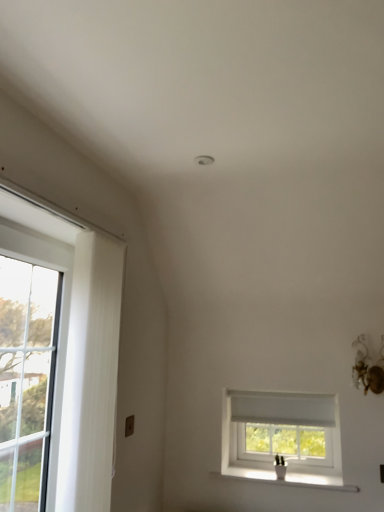
Question: Does point (241, 417) appear closer or farther from the camera than point (261, 477)?

Choices:
 (A) closer
 (B) farther

Answer: (B)

Question: Based on their sizes in the image, would you say white plastic window at center is bigger or smaller than white ceramic vase at lower right?

Choices:
 (A) small
 (B) big

Answer: (B)

Question: Estimate the real-world distances between objects in this image. Which object is closer to the white ceramic vase at lower right?

Choices:
 (A) clear glass door at left
 (B) white plastic window at center
 (C) white textured curtain at left

Answer: (B)

Question: Estimate the real-world distances between objects in this image. Which object is closer to the white ceramic vase at lower right?

Choices:
 (A) clear glass door at left
 (B) white textured curtain at left
 (C) white plastic window at center

Answer: (C)